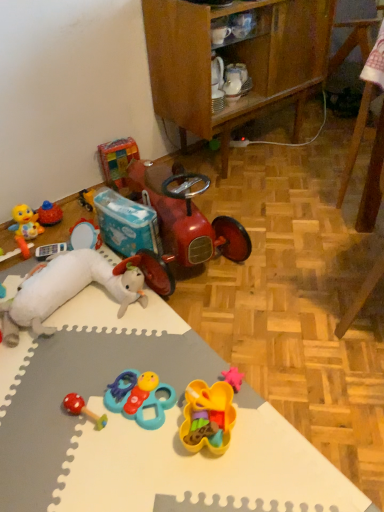
Where is `free space to the left of translucent plastic toy at center, the fifth toy from the back`? free space to the left of translucent plastic toy at center, the fifth toy from the back is located at coordinates (144, 450).